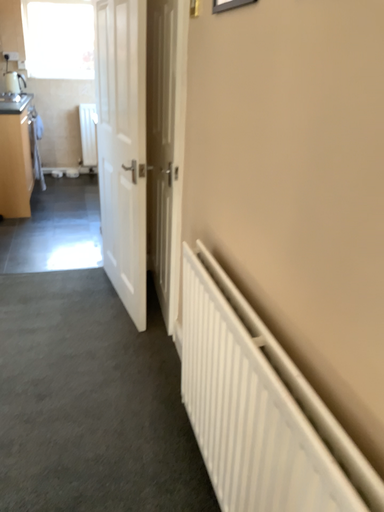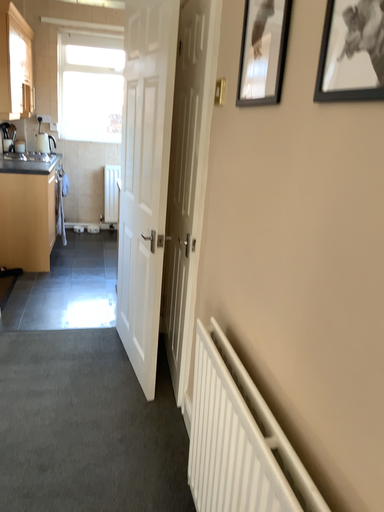
Question: How did the camera likely rotate when shooting the video?

Choices:
 (A) rotated upward
 (B) rotated downward

Answer: (A)